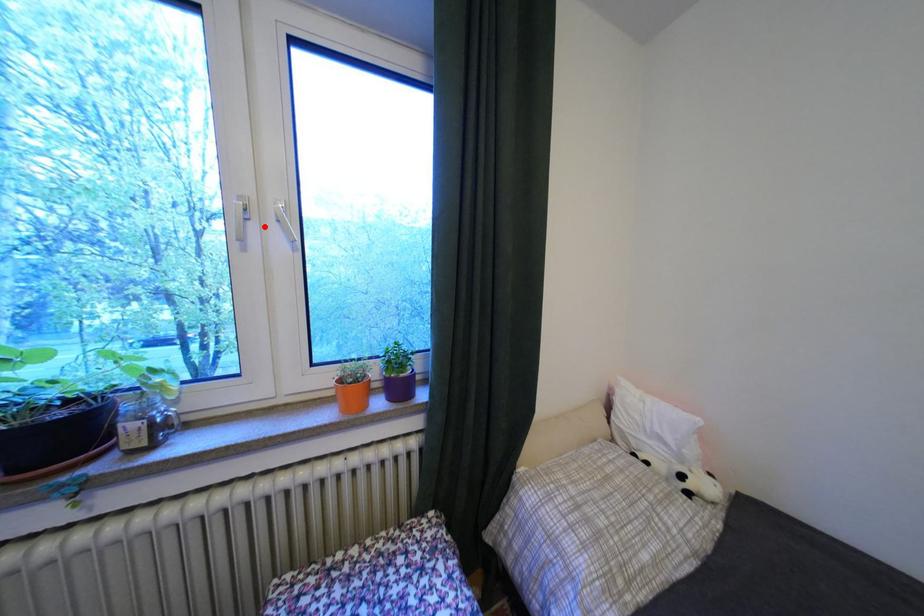
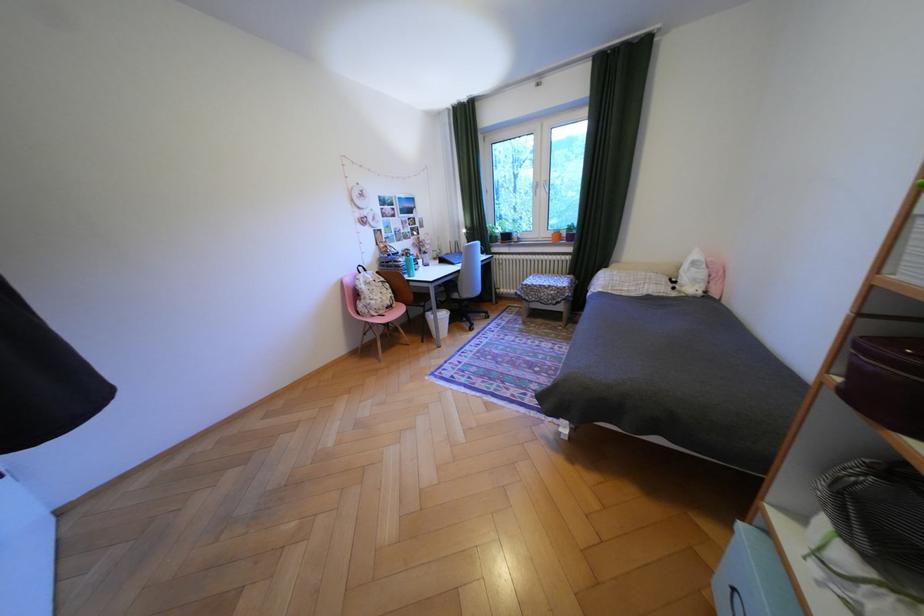
Find the pixel in the second image that matches the highlighted location in the first image.

(551, 190)